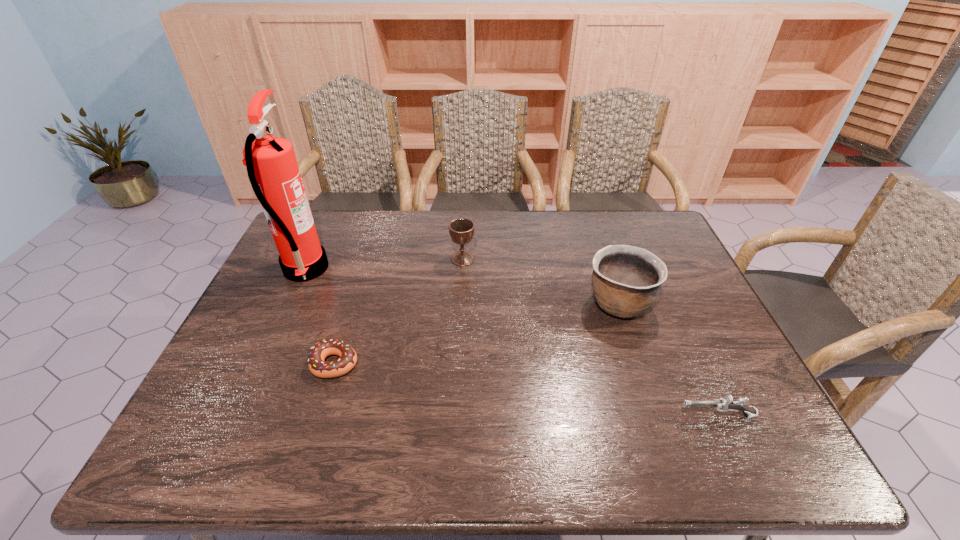
You are a GUI agent. You are given a task and a screenshot of the screen. Output one action in this format:
    pyautogui.click(x=<x>, y=<y>)
    Task: Click on the tallest object
    
    Given the screenshot: What is the action you would take?
    pyautogui.click(x=271, y=164)

This screenshot has width=960, height=540. Find the location of `fire extinguisher`. fire extinguisher is located at coordinates (271, 164).

Locate an element on the screen. pottery is located at coordinates pos(626,280).

Find the location of `the third object from left to right`. the third object from left to right is located at coordinates (461, 230).

This screenshot has height=540, width=960. I want to click on the second shortest object, so click(x=725, y=404).

Locate an element on the screen. Image resolution: width=960 pixels, height=540 pixels. gun is located at coordinates (725, 404).

Where is `the shortest object`? The width and height of the screenshot is (960, 540). the shortest object is located at coordinates (348, 357).

You are a GUI agent. You are given a task and a screenshot of the screen. Output one action in this format:
    pyautogui.click(x=<x>, y=<y>)
    Task: Click on the second nearest object
    This screenshot has width=960, height=540.
    Given the screenshot: What is the action you would take?
    pyautogui.click(x=348, y=357)

The image size is (960, 540). In order to click on vacant area located with the nozzle aimed from the fire extinguisher in this screenshot , I will do `click(356, 269)`.

Identify the location of free location located 0.350m on the front of the pottery. The image size is (960, 540). (670, 454).